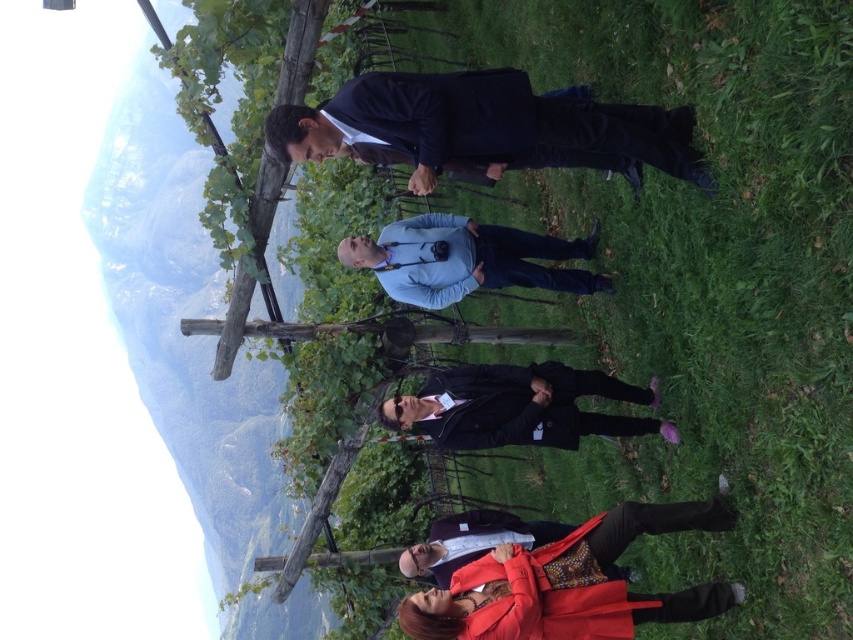
Question: From the image, what is the correct spatial relationship of light blue fabric shirt at center in relation to matte black blazer at lower center?

Choices:
 (A) below
 (B) above

Answer: (B)

Question: Which of the following is the farthest from the observer?

Choices:
 (A) (525, 605)
 (B) (447, 100)

Answer: (B)

Question: Which object appears closest to the camera in this image?

Choices:
 (A) green grass at center
 (B) dark blue suit at center
 (C) matte red coat at lower center

Answer: (A)

Question: Which point is closer to the camera?

Choices:
 (A) (570, 385)
 (B) (722, 513)
 (C) (534, 618)
 (D) (456, 250)

Answer: (B)

Question: Is dark blue suit at center smaller than matte red coat at lower center?

Choices:
 (A) yes
 (B) no

Answer: (A)

Question: Does light blue fabric shirt at center appear on the right side of matte black blazer at lower center?

Choices:
 (A) yes
 (B) no

Answer: (B)